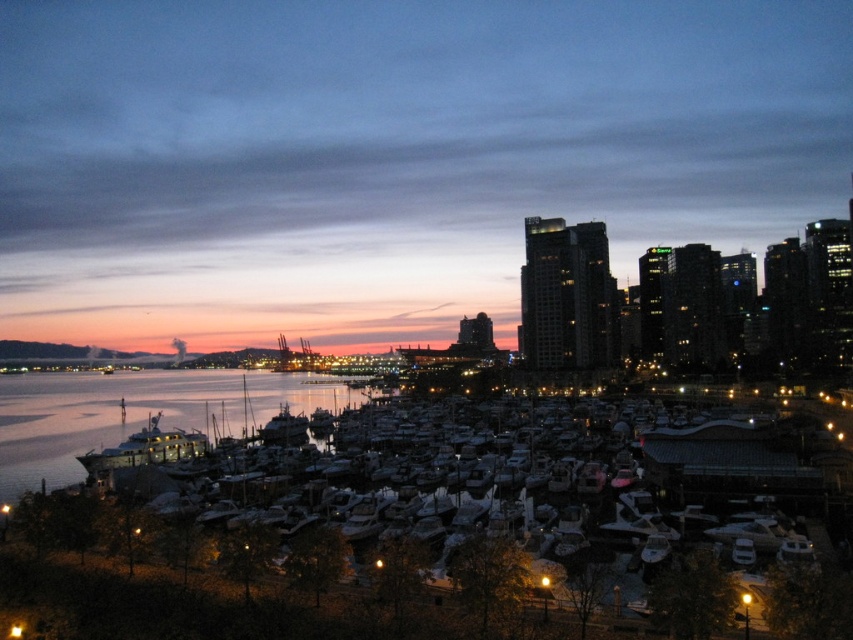
In the scene shown: Can you confirm if glossy water at center is thinner than shiny metallic boat at center?

No, glossy water at center is not thinner than shiny metallic boat at center.

Find the location of `glossy water at center`. glossy water at center is located at coordinates (136, 413).

Image resolution: width=853 pixels, height=640 pixels. I want to click on glossy water at center, so click(136, 413).

What do you see at coordinates (136, 413) in the screenshot? The height and width of the screenshot is (640, 853). I see `glossy water at center` at bounding box center [136, 413].

Is glossy water at center in front of shiny silver yacht at center?

That is True.

Between point (120, 374) and point (154, 461), which one is positioned in front?

Point (154, 461) is more forward.

Image resolution: width=853 pixels, height=640 pixels. Find the location of `glossy water at center`. glossy water at center is located at coordinates (136, 413).

Which is below, shiny silver yacht at center or shiny metallic boat at center?

shiny metallic boat at center is lower down.

Between shiny silver yacht at center and shiny metallic boat at center, which one is positioned higher?

Positioned higher is shiny silver yacht at center.

This screenshot has width=853, height=640. In order to click on shiny silver yacht at center in this screenshot , I will do `click(143, 451)`.